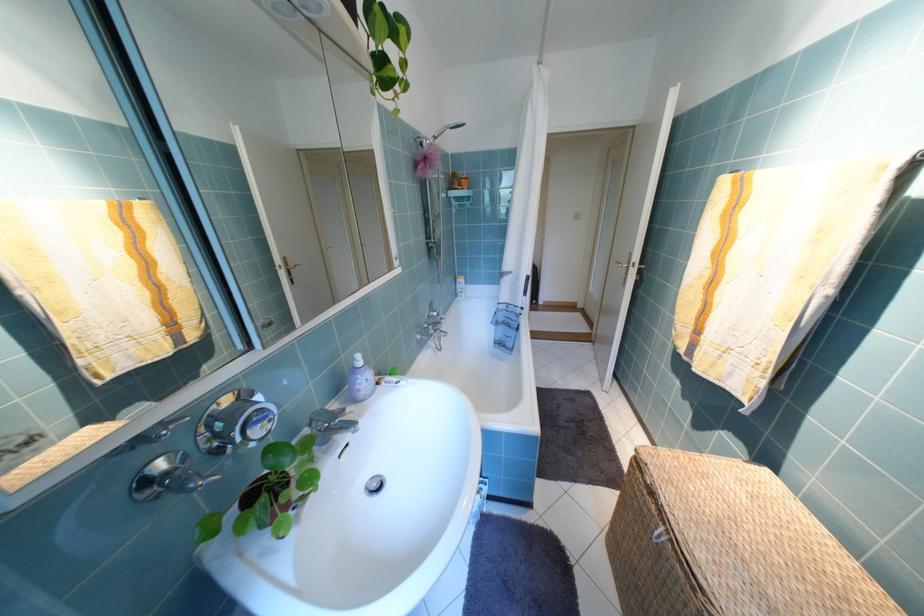
This screenshot has width=924, height=616. Identify the location of chrome diverter knob. (373, 484).